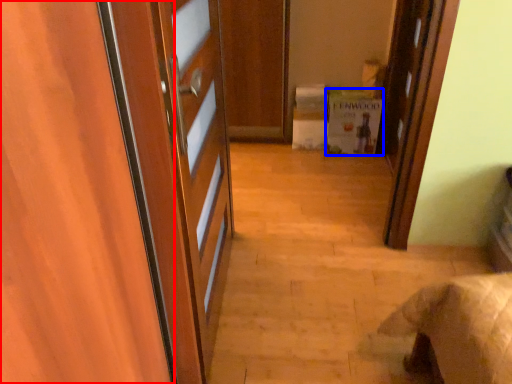
Question: Which point is further to the camera, door (highlighted by a red box) or cabinetry (highlighted by a blue box)?

Choices:
 (A) door
 (B) cabinetry

Answer: (B)